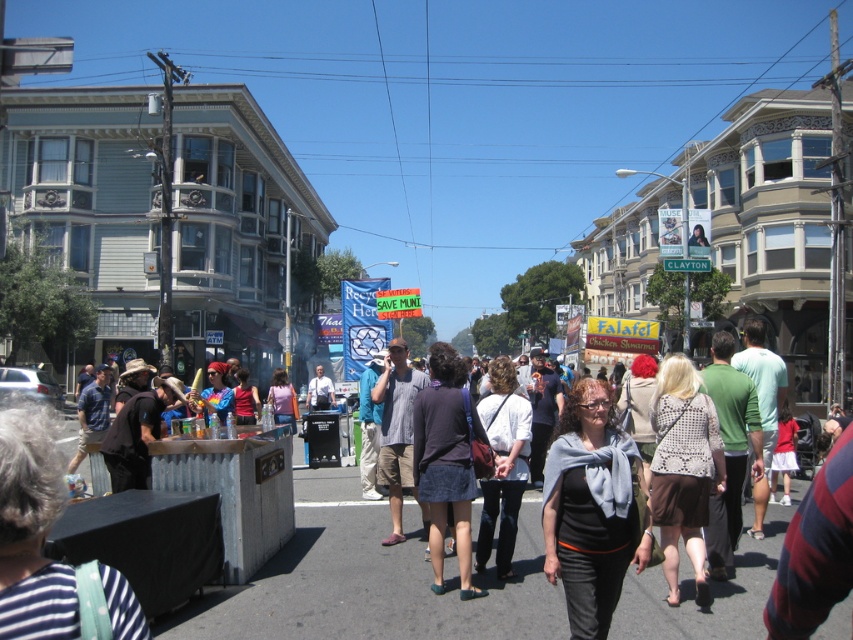
Is dark blue denim skirt at center shorter than light blue shirt at center?

No, dark blue denim skirt at center is not shorter than light blue shirt at center.

From the picture: Between dark blue denim skirt at center and light blue shirt at center, which one has less height?

light blue shirt at center

Locate an element on the screen. The height and width of the screenshot is (640, 853). dark blue denim skirt at center is located at coordinates click(445, 464).

How distant is gray scarf at center from dark blue denim skirt at center?

They are 7.03 feet apart.

Identify the location of gray scarf at center. The image size is (853, 640). (589, 509).

Locate an element on the screen. gray scarf at center is located at coordinates (589, 509).

Can you confirm if black cotton shirt at center is positioned to the left of light blue shirt at center?

In fact, black cotton shirt at center is to the right of light blue shirt at center.

This screenshot has width=853, height=640. What do you see at coordinates (490, 593) in the screenshot?
I see `black cotton shirt at center` at bounding box center [490, 593].

Find the location of a particular element. black cotton shirt at center is located at coordinates (490, 593).